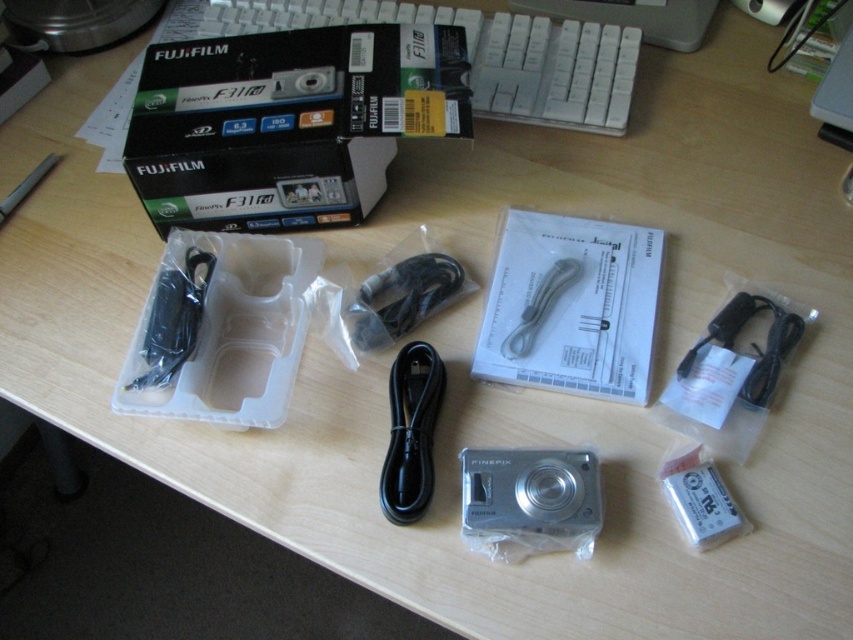
Does white plastic keyboard at upper center appear over black plastic charger at right?

Indeed, white plastic keyboard at upper center is positioned over black plastic charger at right.

Which of these two, white plastic keyboard at upper center or black plastic charger at right, stands shorter?

black plastic charger at right is shorter.

Image resolution: width=853 pixels, height=640 pixels. In order to click on white plastic keyboard at upper center in this screenshot , I will do `click(486, 54)`.

Who is higher up, white plastic keyboard at upper center or wooden at upper center?

wooden at upper center is above.

Which is in front, point (595, 90) or point (657, 12)?

Point (595, 90) is more forward.

Identify the location of white plastic keyboard at upper center. This screenshot has height=640, width=853. (486, 54).

Who is taller, white plastic keyboard at upper center or silver metallic camera at center?

With more height is white plastic keyboard at upper center.

Image resolution: width=853 pixels, height=640 pixels. What do you see at coordinates (486, 54) in the screenshot?
I see `white plastic keyboard at upper center` at bounding box center [486, 54].

At what (x,y) coordinates should I click in order to perform the action: click on white plastic keyboard at upper center. Please return your answer as a coordinate pair (x, y). Image resolution: width=853 pixels, height=640 pixels. Looking at the image, I should click on (486, 54).

Where is `white plastic keyboard at upper center`? The height and width of the screenshot is (640, 853). white plastic keyboard at upper center is located at coordinates (486, 54).